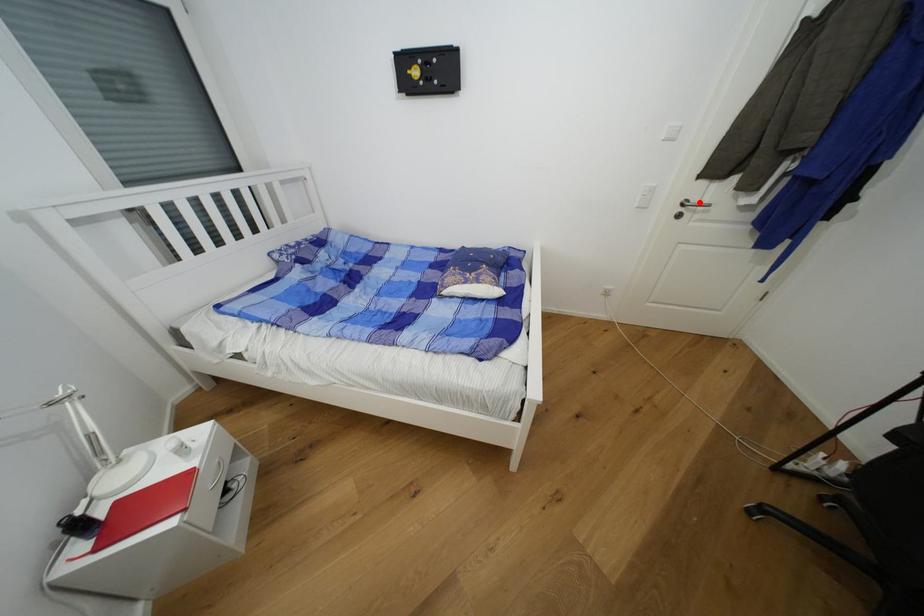
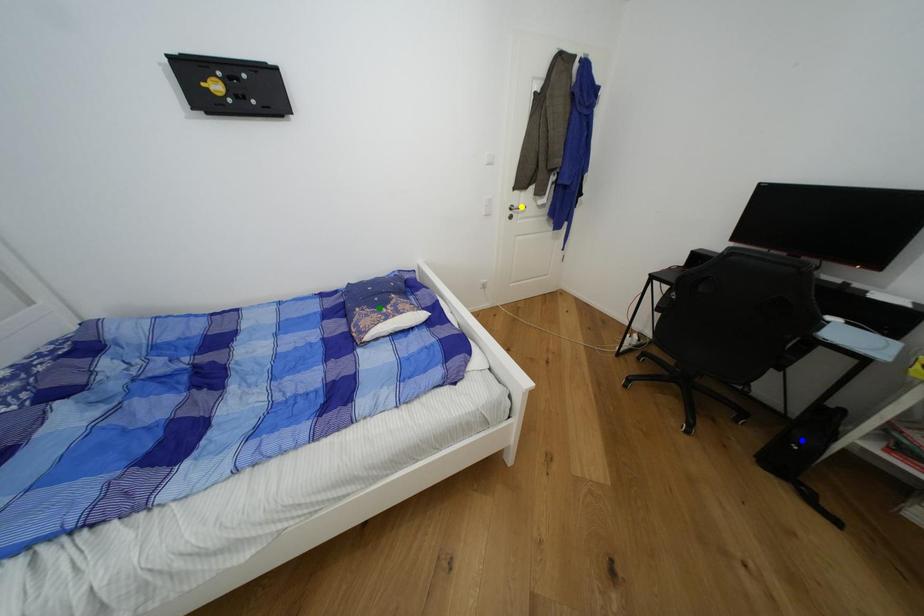
Question: I am providing you with two images of the same scene from different viewpoints. A red point is marked on the first image. You are given multiple points on the second image. Which point in image 2 is actually the same real-world point as the red point in image 1?

Choices:
 (A) yellow point
 (B) blue point
 (C) green point

Answer: (A)